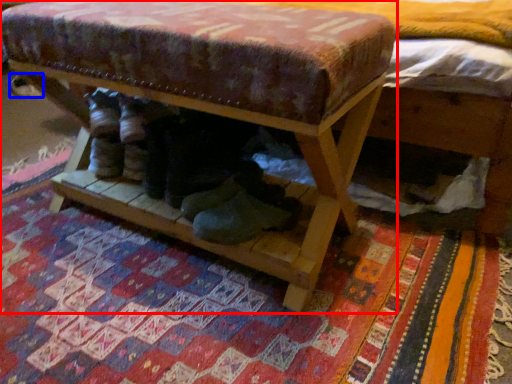
Question: Which point is closer to the camera, furniture (highlighted by a red box) or shoe (highlighted by a blue box)?

Choices:
 (A) furniture
 (B) shoe

Answer: (A)